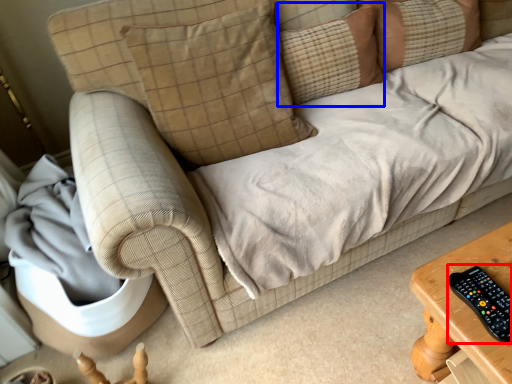
Question: Which of the following is the closest to the observer, control (highlighted by a red box) or pillow (highlighted by a blue box)?

Choices:
 (A) control
 (B) pillow

Answer: (A)